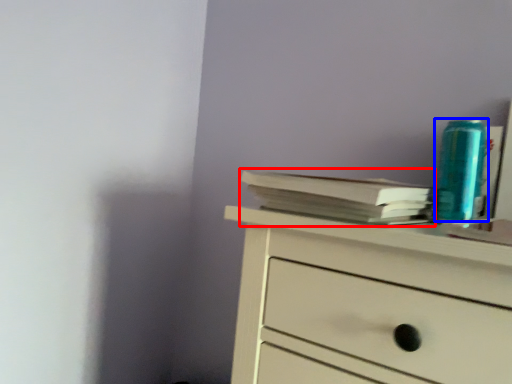
Question: Among these objects, which one is nearest to the camera, paperback book (highlighted by a red box) or teal (highlighted by a blue box)?

Choices:
 (A) paperback book
 (B) teal

Answer: (A)